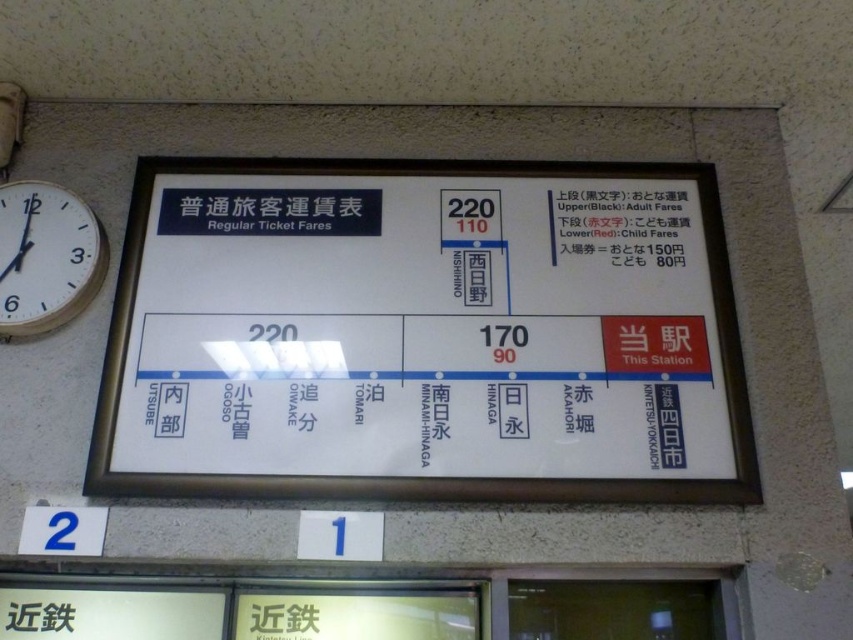
You are standing in front of the station fare board and want to know where the wooden clock face at left is located. Can you describe its position relative to the board?

The wooden clock face at left is located at point (45, 257) on the board.